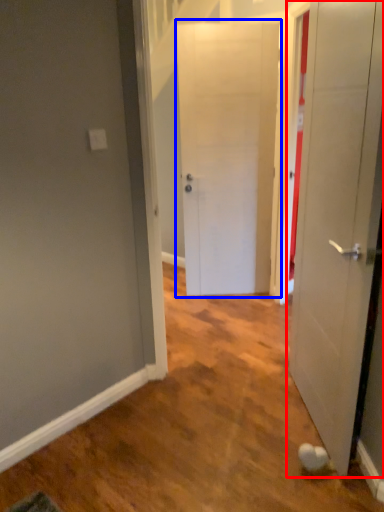
Question: Among these objects, which one is nearest to the camera, door (highlighted by a red box) or door (highlighted by a blue box)?

Choices:
 (A) door
 (B) door

Answer: (A)